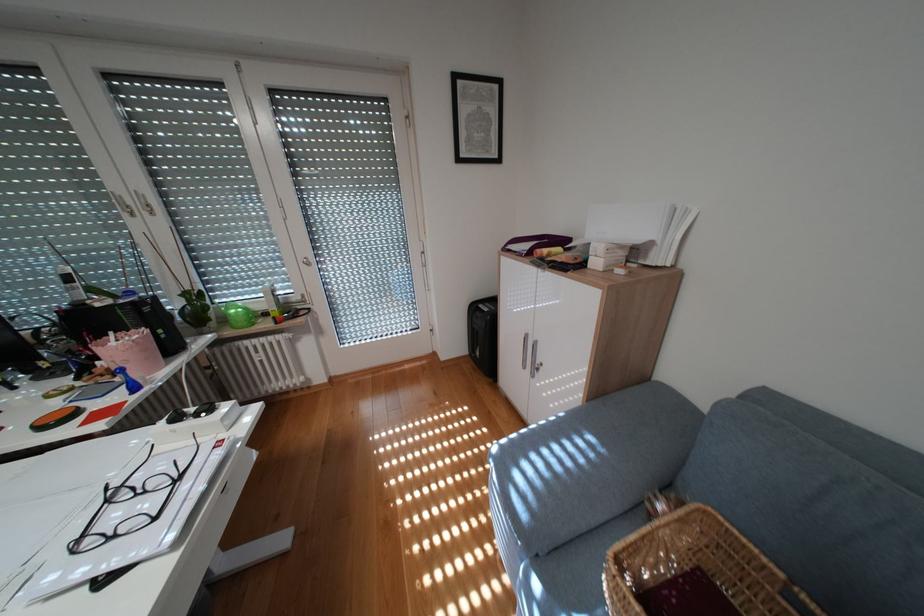
Where is `white door handle`? The width and height of the screenshot is (924, 616). white door handle is located at coordinates (143, 203).